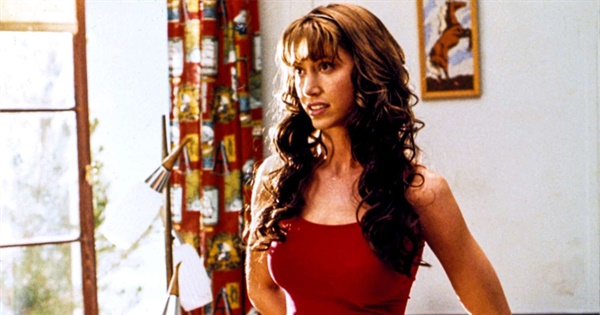
Where is `curtains`? The image size is (600, 315). curtains is located at coordinates (196, 86).